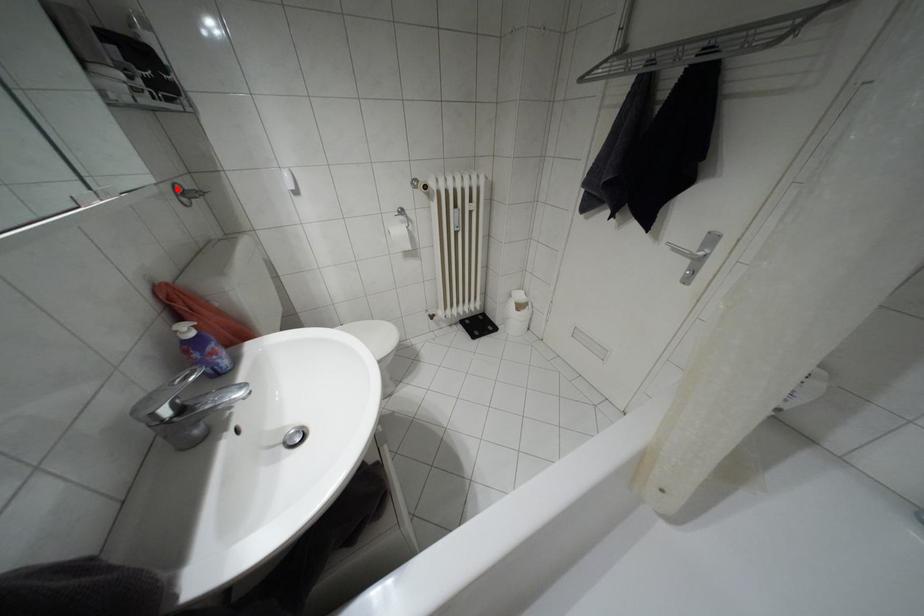
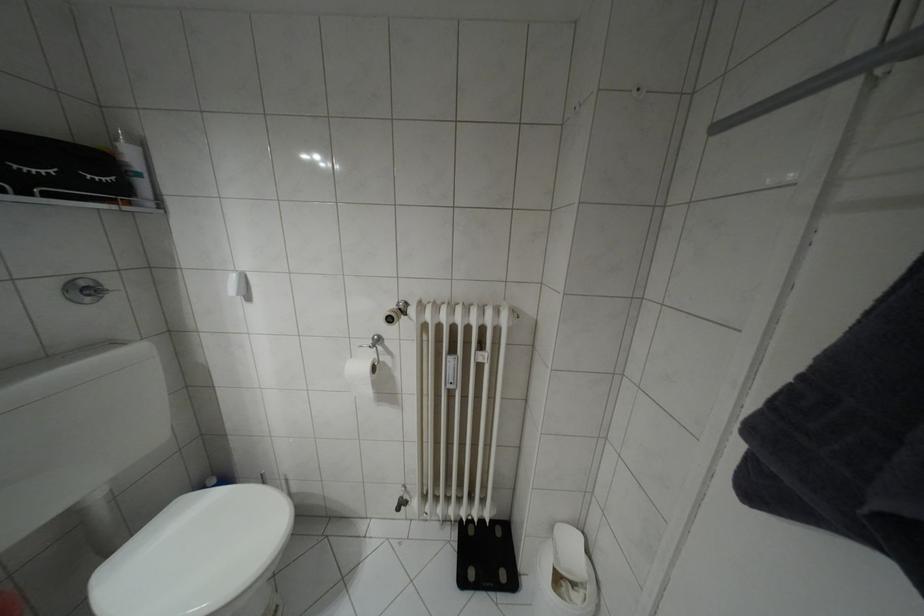
Find the pixel in the second image that matches the highlighted location in the first image.

(81, 284)